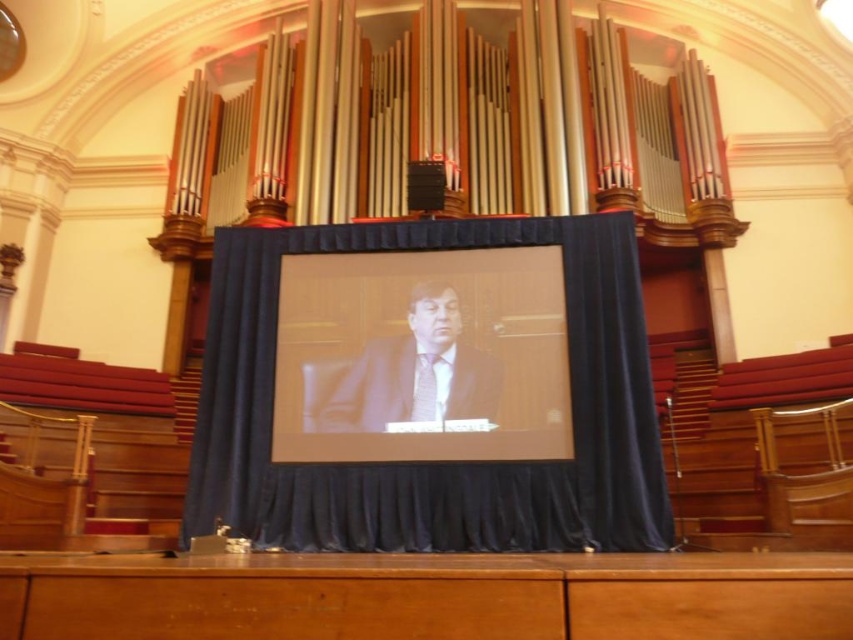
Question: Which is farther from the matte suit at center?

Choices:
 (A) velvet blue curtain at center
 (B) matte black screen at center

Answer: (A)

Question: Is velvet blue curtain at center thinner than matte suit at center?

Choices:
 (A) no
 (B) yes

Answer: (A)

Question: Is the position of velvet blue curtain at center more distant than that of matte black screen at center?

Choices:
 (A) no
 (B) yes

Answer: (A)

Question: Which object appears farthest from the camera in this image?

Choices:
 (A) matte black screen at center
 (B) matte suit at center

Answer: (B)

Question: Which object is the closest to the velvet blue curtain at center?

Choices:
 (A) matte suit at center
 (B) matte black screen at center

Answer: (B)

Question: Is velvet blue curtain at center in front of matte suit at center?

Choices:
 (A) yes
 (B) no

Answer: (A)